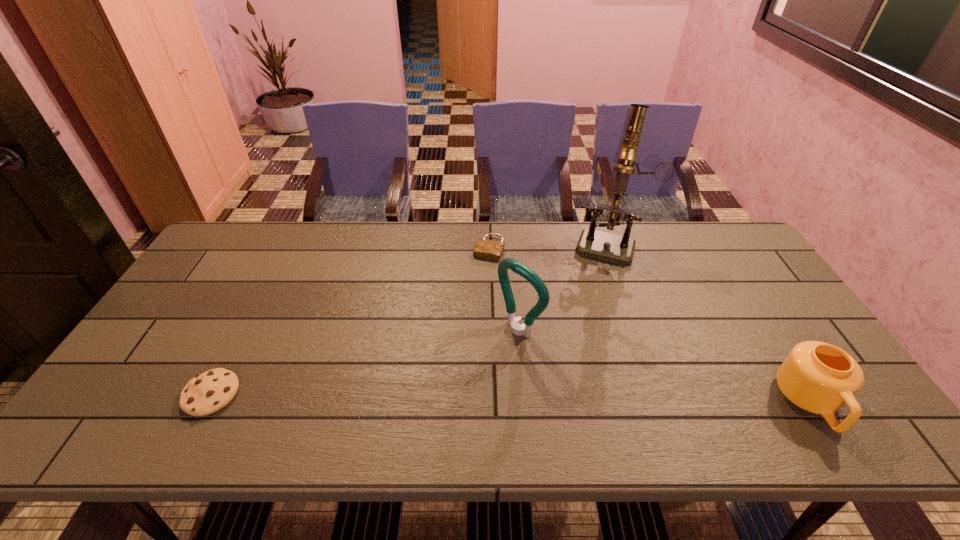
The height and width of the screenshot is (540, 960). I want to click on the fourth tallest object, so click(x=209, y=392).

This screenshot has height=540, width=960. Find the location of `the leftmost object`. the leftmost object is located at coordinates (209, 392).

The height and width of the screenshot is (540, 960). Identify the location of the rightmost object. (818, 377).

Image resolution: width=960 pixels, height=540 pixels. Find the location of `mug`. mug is located at coordinates (818, 377).

Where is `the third farthest object`? the third farthest object is located at coordinates (516, 328).

Find the location of `bottle opener`. bottle opener is located at coordinates (x=516, y=328).

Identify the location of padlock. The width and height of the screenshot is (960, 540). (487, 249).

Where is `the tallest object`? The image size is (960, 540). the tallest object is located at coordinates (612, 247).

Locate an element on the screen. The image size is (960, 540). the second object from right to left is located at coordinates (612, 247).

The image size is (960, 540). I want to click on vacant space situated 0.350m on the right of the cookie, so click(385, 394).